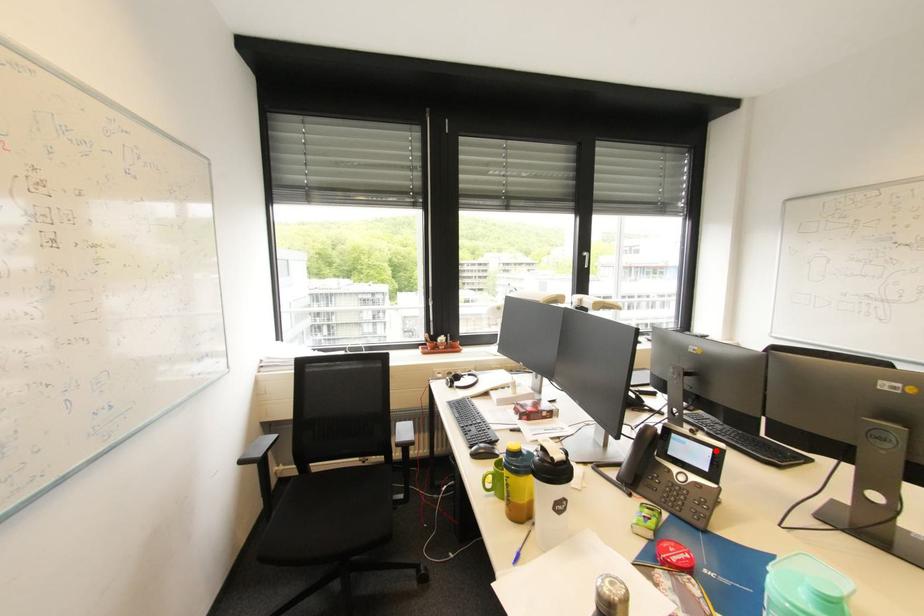
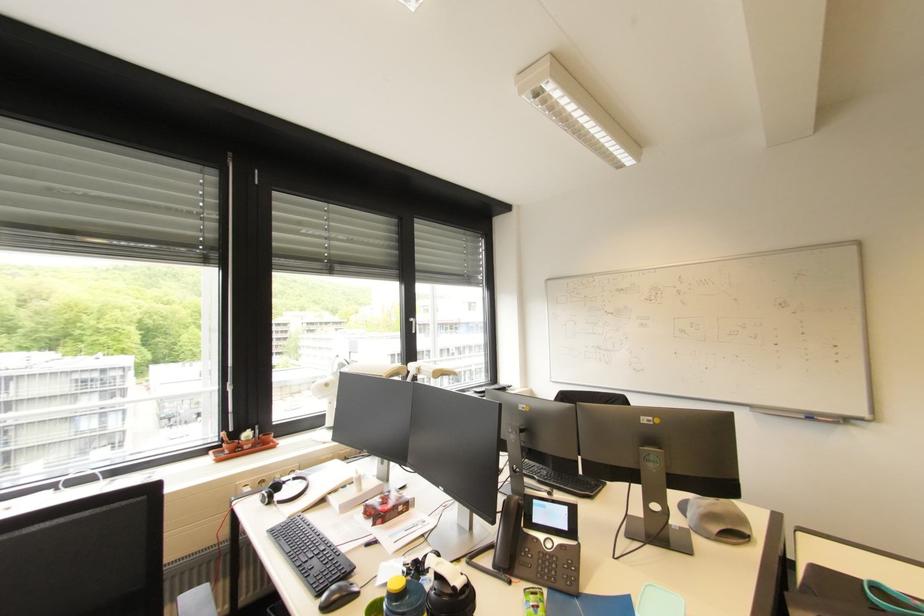
Question: I am providing you with two images of the same scene from different viewpoints. Given a red point in image1, look at the same physical point in image2. Is it:

Choices:
 (A) Closer to the viewpoint
 (B) Farther from the viewpoint

Answer: (A)